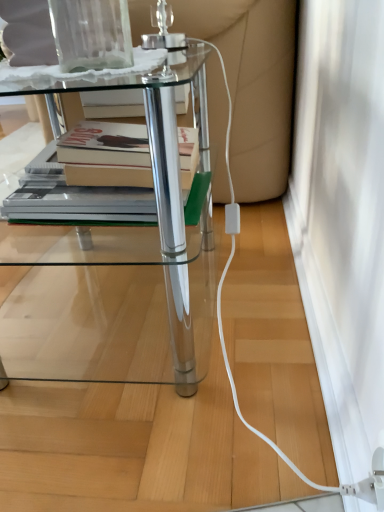
Question: From a real-world perspective, is white matte screen door at lower right positioned above or below transparent glass vase at upper center?

Choices:
 (A) above
 (B) below

Answer: (B)

Question: From the image's perspective, is white matte screen door at lower right positioned above or below transparent glass vase at upper center?

Choices:
 (A) above
 (B) below

Answer: (B)

Question: Which object is positioned farthest from the transparent glass vase at upper center?

Choices:
 (A) clear glass table at center
 (B) white matte screen door at lower right

Answer: (B)

Question: Considering the real-world distances, which object is closest to the white matte screen door at lower right?

Choices:
 (A) clear glass table at center
 (B) transparent glass vase at upper center

Answer: (A)